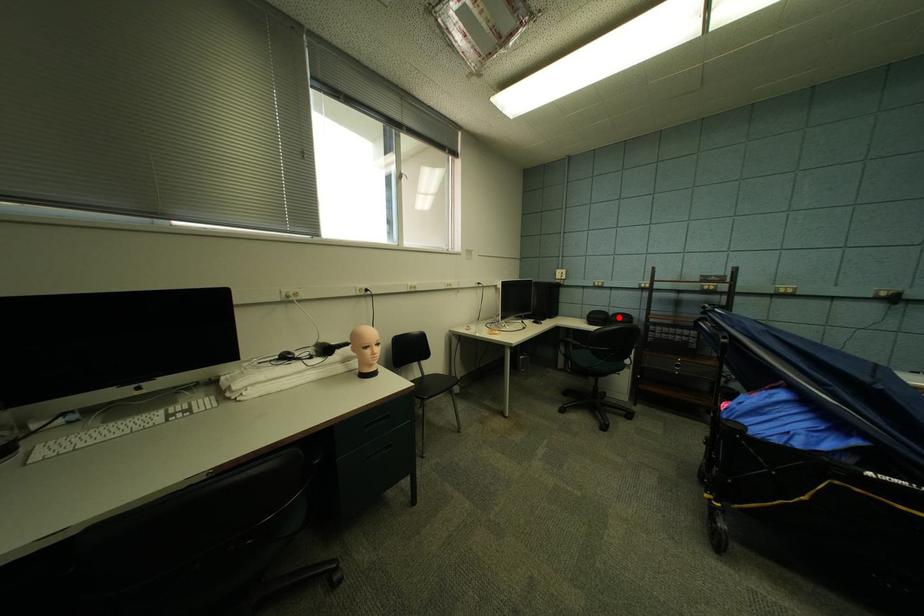
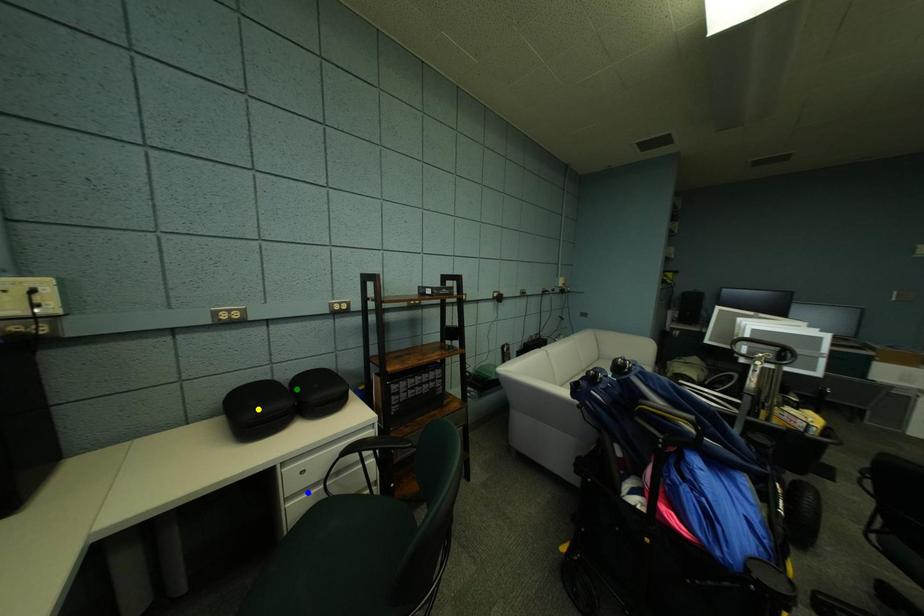
Question: I am providing you with two images of the same scene from different viewpoints. A red point is marked on the first image. You are given multiple points on the second image. Can you choose the point in image 2 that corresponds to the point in image 1?

Choices:
 (A) green point
 (B) yellow point
 (C) blue point

Answer: (A)